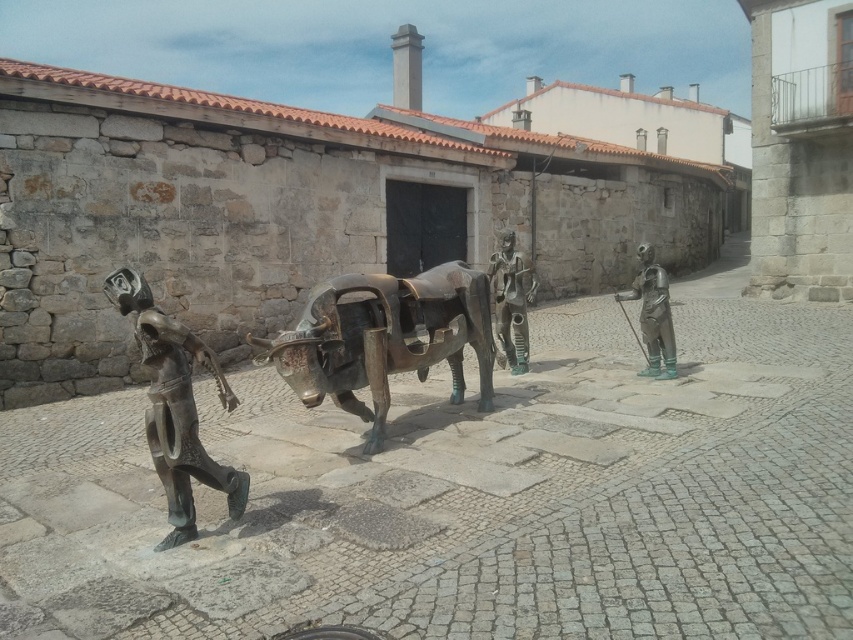
You are an art student analyzing the placement of the statues in the image. Based on their positions, which statue is closer to the viewer, the bronze statue at center or the green patina statue at right?

The bronze statue at center is closer to the viewer than the green patina statue at right because it is positioned to the left of the green patina statue at right.

You are a tourist standing on the cobblestone street and want to take a photo of both the bronze figure at left and the green patina statue at right. Which direction should you face to ensure both are in the frame?

You should face towards the center of the cobblestone street so that the bronze figure at left is to the left of the green patina statue at right in your viewfinder.

You are an art conservator assessing the space between two sculptures in the cobblestone street scene. The bronze figure at left and the green patina statue at right are both part of the installation. Based on their sizes, which sculpture would require more space for proper maintenance and why?

The bronze figure at left requires more space for proper maintenance because its width is larger than the green patina statue at right.